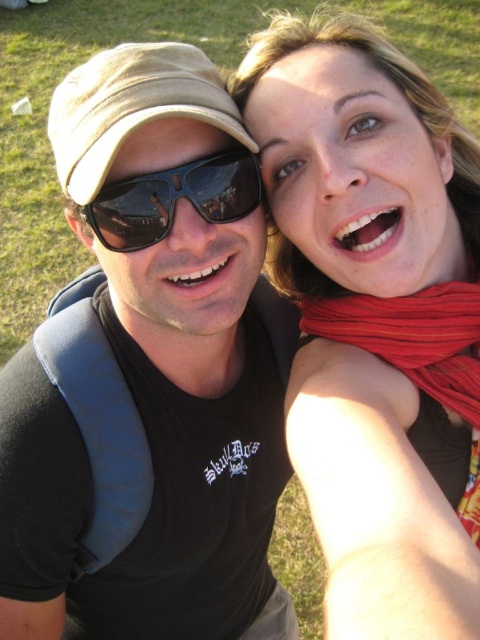
Question: Is matte black scarf at upper right positioned behind sunglasses at center?

Choices:
 (A) yes
 (B) no

Answer: (B)

Question: Based on their relative distances, which object is farther from the sunglasses at center?

Choices:
 (A) matte black scarf at upper right
 (B) red knitted scarf at upper right
 (C) black matte sunglasses at upper center
 (D) tan fabric baseball cap at upper left

Answer: (B)

Question: Is red knitted scarf at upper right smaller than sunglasses at center?

Choices:
 (A) yes
 (B) no

Answer: (B)

Question: Which of the following is the closest to the observer?

Choices:
 (A) matte black scarf at upper right
 (B) red knitted scarf at upper right
 (C) sunglasses at center
 (D) black matte sunglasses at upper center

Answer: (A)

Question: Which object appears farthest from the camera in this image?

Choices:
 (A) black matte sunglasses at upper center
 (B) tan fabric baseball cap at upper left
 (C) sunglasses at center

Answer: (C)

Question: Can you confirm if black matte sunglasses at upper center is smaller than tan fabric baseball cap at upper left?

Choices:
 (A) yes
 (B) no

Answer: (B)